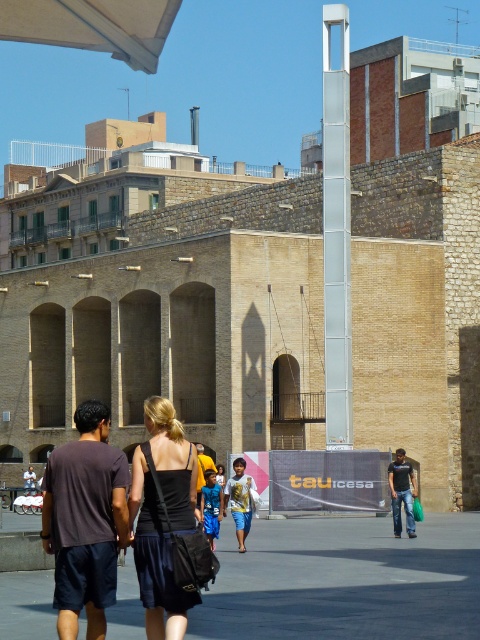
Who is more forward, (167, 403) or (120, 10)?

Point (167, 403) is more forward.

The image size is (480, 640). What do you see at coordinates (162, 516) in the screenshot? I see `black fabric dress at center` at bounding box center [162, 516].

Image resolution: width=480 pixels, height=640 pixels. In order to click on black fabric dress at center in this screenshot , I will do `click(162, 516)`.

Is the position of gray concrete pavement at center more distant than that of black fabric dress at center?

Yes.

Can you confirm if gray concrete pavement at center is thinner than black fabric dress at center?

No.

Which is behind, point (275, 545) or point (144, 604)?

The point (275, 545) is behind.

This screenshot has height=640, width=480. In order to click on gray concrete pavement at center in this screenshot , I will do `click(345, 580)`.

Between white glass pillar at center and dark gray t-shirt at center, which one appears on the right side from the viewer's perspective?

From the viewer's perspective, white glass pillar at center appears more on the right side.

Is point (345, 384) farther from camera compared to point (389, 490)?

That is True.

Find the location of `white glass pillar at center`. white glass pillar at center is located at coordinates (336, 234).